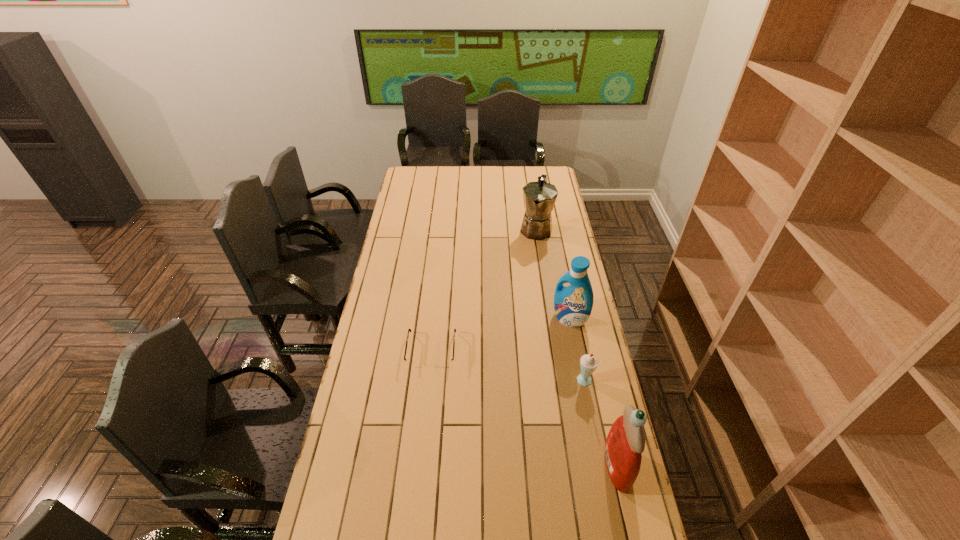
The width and height of the screenshot is (960, 540). In order to click on free space at the near edge of the desktop in this screenshot , I will do `click(540, 529)`.

I want to click on vacant space at the left edge of the desktop, so click(x=387, y=291).

Image resolution: width=960 pixels, height=540 pixels. In the image, there is a desktop. What are the coordinates of `free space at the right edge` in the screenshot? It's located at (560, 200).

Identify the location of vacant space at the far left corner of the desktop. Image resolution: width=960 pixels, height=540 pixels. (416, 178).

Locate an element on the screen. Image resolution: width=960 pixels, height=540 pixels. free space between the farthest object and the shortest object is located at coordinates (484, 289).

Find the location of a particular element. The width and height of the screenshot is (960, 540). empty space that is in between the fourth nearest object and the nearer detergent is located at coordinates (593, 393).

The image size is (960, 540). I want to click on vacant area that lies between the third nearest object and the nearest object, so click(x=524, y=409).

Identify the location of blank region between the farthest object and the nearest object. Image resolution: width=960 pixels, height=540 pixels. (576, 347).

Identify the location of vacant area between the leftmost object and the nearer detergent. (524, 409).

Where is `empty space that is in between the nearer detergent and the milkshake`? This screenshot has height=540, width=960. empty space that is in between the nearer detergent and the milkshake is located at coordinates (601, 424).